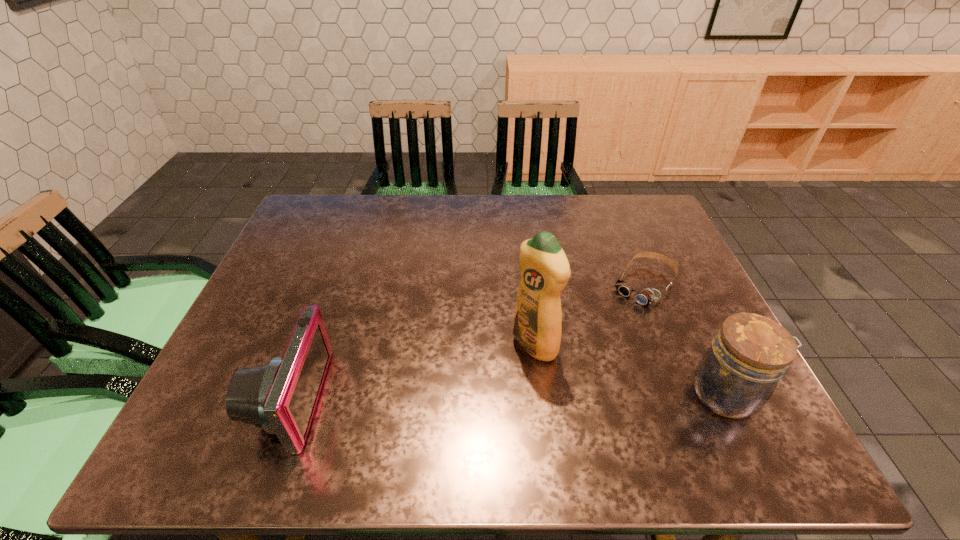
The width and height of the screenshot is (960, 540). Identify the location of free space on the desktop that is between the leftmost object and the jar and is positioned on the front-facing side of the farthest object. (551, 396).

Where is `vacant space on the desktop that is between the leftmost object and the jar and is positioned on the label of the third object from right to left`? The image size is (960, 540). vacant space on the desktop that is between the leftmost object and the jar and is positioned on the label of the third object from right to left is located at coordinates (470, 396).